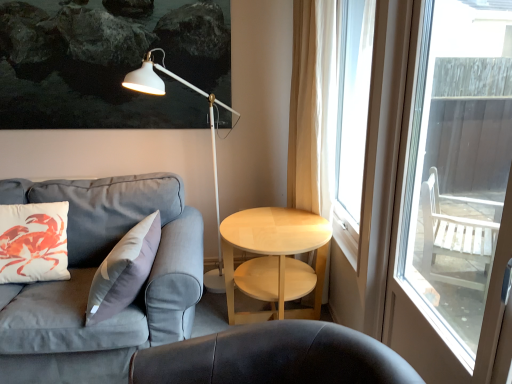
Question: Can you confirm if white matte floor lamp at upper center is positioned to the left of transparent glass door at right?

Choices:
 (A) yes
 (B) no

Answer: (A)

Question: Is white matte floor lamp at upper center in front of transparent glass door at right?

Choices:
 (A) no
 (B) yes

Answer: (A)

Question: From a real-world perspective, is white matte floor lamp at upper center physically above transparent glass door at right?

Choices:
 (A) no
 (B) yes

Answer: (A)

Question: Is white matte floor lamp at upper center outside of transparent glass door at right?

Choices:
 (A) no
 (B) yes

Answer: (B)

Question: Can you confirm if white matte floor lamp at upper center is smaller than transparent glass door at right?

Choices:
 (A) no
 (B) yes

Answer: (A)

Question: Does white matte floor lamp at upper center turn towards transparent glass door at right?

Choices:
 (A) no
 (B) yes

Answer: (A)

Question: Can you confirm if white glossy table at right is positioned to the left of transparent glass door at right?

Choices:
 (A) yes
 (B) no

Answer: (A)

Question: From the image's perspective, is white glossy table at right below transparent glass door at right?

Choices:
 (A) yes
 (B) no

Answer: (A)

Question: Does white glossy table at right appear on the right side of transparent glass door at right?

Choices:
 (A) yes
 (B) no

Answer: (B)

Question: Is white glossy table at right looking in the opposite direction of transparent glass door at right?

Choices:
 (A) no
 (B) yes

Answer: (A)

Question: Does white glossy table at right touch transparent glass door at right?

Choices:
 (A) no
 (B) yes

Answer: (A)

Question: From the image's perspective, does white glossy table at right appear higher than transparent glass door at right?

Choices:
 (A) yes
 (B) no

Answer: (B)

Question: Are white matte pillow at left and white sheer curtain at right far apart?

Choices:
 (A) no
 (B) yes

Answer: (B)